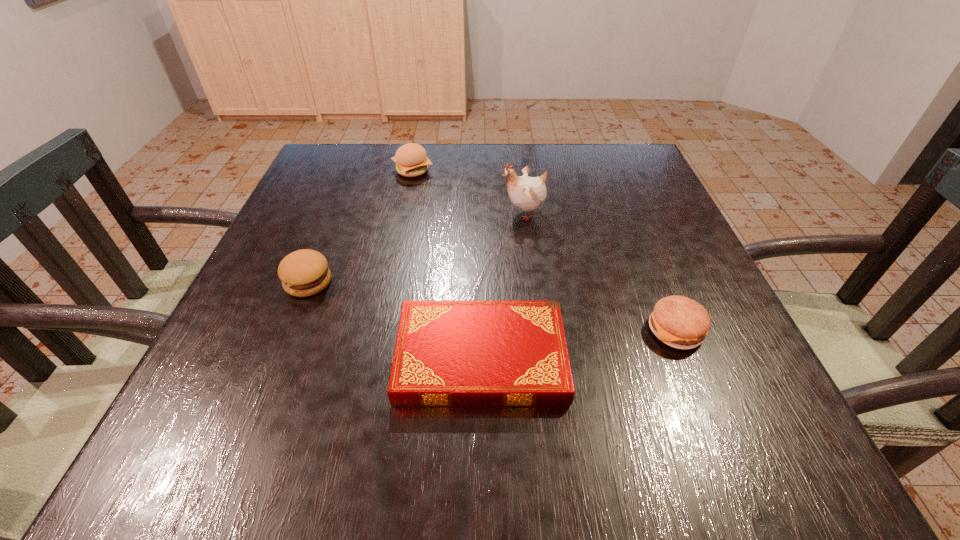
This screenshot has height=540, width=960. In order to click on bird in this screenshot , I will do `click(527, 193)`.

What are the coordinates of `the tallest object` in the screenshot? It's located at (527, 193).

The width and height of the screenshot is (960, 540). I want to click on the farthest object, so click(x=411, y=160).

Find the location of a particular element. the farthest hamburger is located at coordinates (411, 160).

The image size is (960, 540). I want to click on the leftmost hamburger, so click(x=305, y=272).

The image size is (960, 540). Find the location of `the third farthest object`. the third farthest object is located at coordinates (305, 272).

Identify the location of the rightmost object. The height and width of the screenshot is (540, 960). (680, 322).

Where is `the rightmost hamburger`? This screenshot has width=960, height=540. the rightmost hamburger is located at coordinates (680, 322).

Image resolution: width=960 pixels, height=540 pixels. Identify the location of the shortest object. (448, 353).

Locate an element on the screen. The width and height of the screenshot is (960, 540). free space located 0.180m at the beak of the bird is located at coordinates (421, 213).